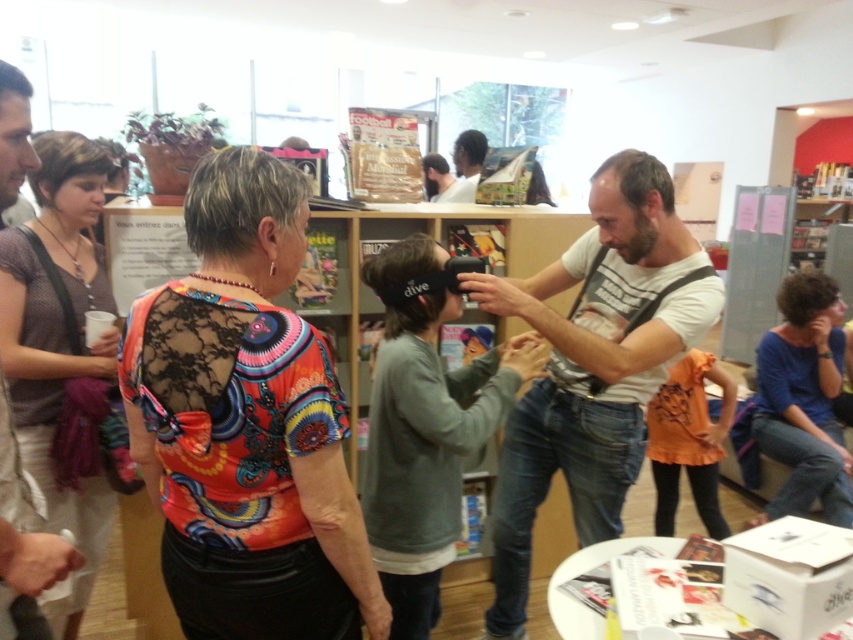
From the picture: You are a fashion designer observing the scene. You need to decide which garment has a larger width for a size chart. Which one is wider between the multicolored lace top at center and the dark gray sweater at center?

The multicolored lace top at center is wider than the dark gray sweater at center according to the description.

You are a fashion designer observing the scene. You need to determine which clothing item is bigger between the multicolored lace top at center and the matte white shirt at upper center. Which one is larger?

The multicolored lace top at center is larger than the matte white shirt at upper center according to the description.

You are standing in the center of the room and want to take a photo of the multicolored lace top at center. Which direction should you move to get a better view of it?

The multicolored lace top at center is located at point (247,422), so you should move towards the right side of the room to get a better view of it.